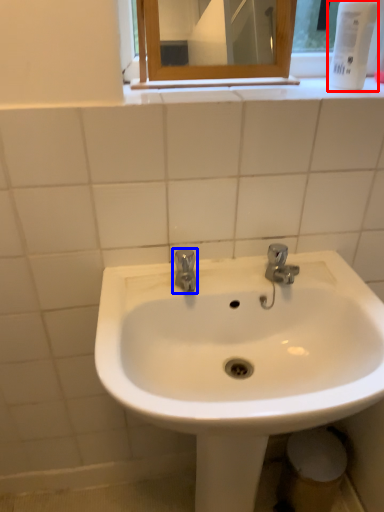
Question: Among these objects, which one is farthest to the camera, mouthwash (highlighted by a red box) or tap (highlighted by a blue box)?

Choices:
 (A) mouthwash
 (B) tap

Answer: (B)